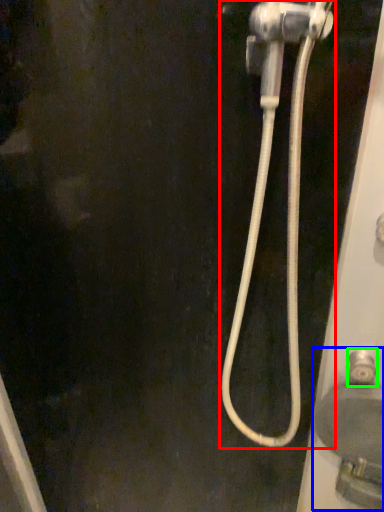
Question: Which is farther away from plumbing fixture (highlighted by a red box)? sink (highlighted by a blue box) or faucet (highlighted by a green box)?

Choices:
 (A) sink
 (B) faucet

Answer: (B)